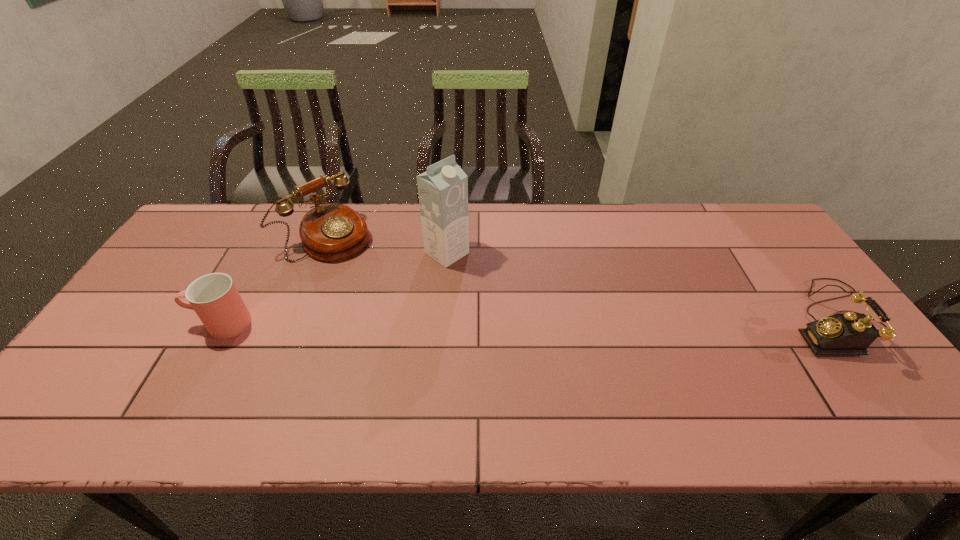
At what (x,y) coordinates should I click in order to perform the action: click on vacant point located between the cup and the nearer telephone. Please return your answer as a coordinate pair (x, y). Looking at the image, I should click on tap(527, 321).

Locate an element on the screen. This screenshot has height=540, width=960. empty space between the tallest object and the right telephone is located at coordinates (640, 286).

This screenshot has height=540, width=960. Identify the location of vacant region between the rightmost object and the tallest object. (640, 286).

Identify the location of blank region between the carton and the farther telephone. This screenshot has width=960, height=540. coord(387,245).

I want to click on free space between the rightmost object and the cup, so click(x=527, y=321).

You are a GUI agent. You are given a task and a screenshot of the screen. Output one action in this format:
    pyautogui.click(x=<x>, y=<y>)
    Task: Click on the vacant point located between the second tallest object and the carton
    The height and width of the screenshot is (540, 960).
    Given the screenshot: What is the action you would take?
    pyautogui.click(x=387, y=245)

Where is `vacant space in between the cup and the tallest object`? vacant space in between the cup and the tallest object is located at coordinates [334, 288].

In order to click on free space between the cup and the left telephone in this screenshot , I will do `click(274, 280)`.

I want to click on blank region between the rightmost object and the second object from right to left, so click(640, 286).

Identify the location of empty space between the left telephone and the rightmost object. The image size is (960, 540). (580, 278).